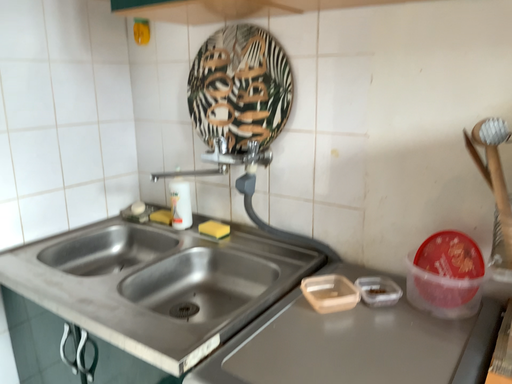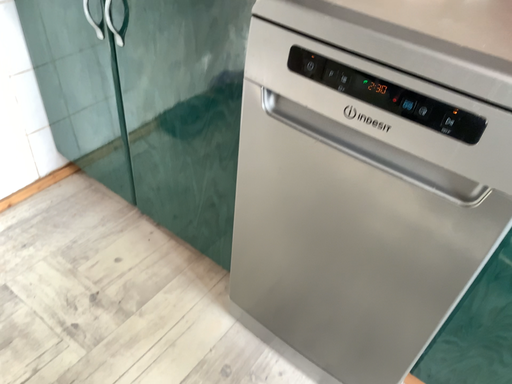
Question: How did the camera likely rotate when shooting the video?

Choices:
 (A) rotated downward
 (B) rotated upward

Answer: (A)